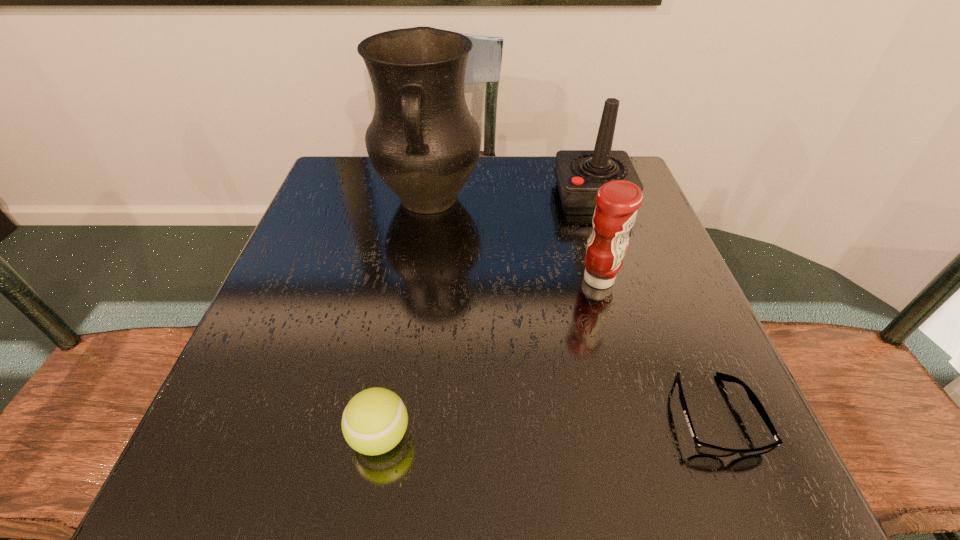
Locate an element on the screen. The width and height of the screenshot is (960, 540). free location located 0.260m on the left of the condiment is located at coordinates (444, 279).

You are a GUI agent. You are given a task and a screenshot of the screen. Output one action in this format:
    pyautogui.click(x=<x>, y=<y>)
    Task: Click on the blank space located 0.210m on the back of the second shortest object
    This screenshot has height=540, width=960.
    Given the screenshot: What is the action you would take?
    pyautogui.click(x=402, y=305)

The width and height of the screenshot is (960, 540). In order to click on pitcher that is at the far edge in this screenshot , I will do coord(423,142).

You are a GUI agent. You are given a task and a screenshot of the screen. Output one action in this format:
    pyautogui.click(x=<x>, y=<y>)
    Task: Click on the joystick that is positioned at the far edge
    The width and height of the screenshot is (960, 540).
    Given the screenshot: What is the action you would take?
    pyautogui.click(x=579, y=174)

You are a GUI agent. You are given a task and a screenshot of the screen. Output one action in this format:
    pyautogui.click(x=<x>, y=<y>)
    Task: Click on the tennis ball situated at the near edge
    The height and width of the screenshot is (540, 960).
    Given the screenshot: What is the action you would take?
    pyautogui.click(x=375, y=420)

Where is `sunglasses that is at the near edge`? The image size is (960, 540). sunglasses that is at the near edge is located at coordinates (702, 448).

Find the location of a particular element. The image size is (960, 540). object that is at the left edge is located at coordinates (423, 142).

Find the location of a particular element. joystick that is at the right edge is located at coordinates (579, 174).

This screenshot has height=540, width=960. I want to click on condiment that is at the right edge, so click(618, 201).

Locate an element on the screen. Image resolution: width=960 pixels, height=540 pixels. sunglasses present at the right edge is located at coordinates (702, 448).